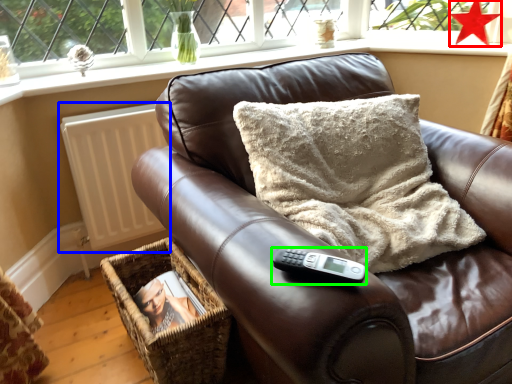
Question: Which is nearer to the star (highlighted by a red box)? radiator (highlighted by a blue box) or remote (highlighted by a green box).

Choices:
 (A) radiator
 (B) remote

Answer: (A)